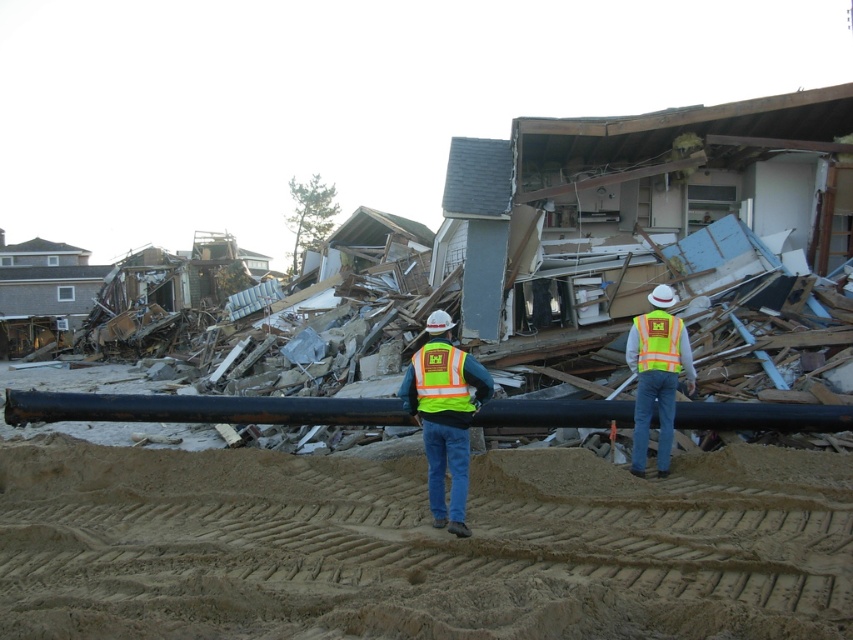
Does brown sandy dirt track at lower center appear on the right side of yellow reflective safety vest at center?

Correct, you'll find brown sandy dirt track at lower center to the right of yellow reflective safety vest at center.

Based on the photo, who is lower down, brown sandy dirt track at lower center or yellow reflective safety vest at center?

brown sandy dirt track at lower center

Locate an element on the screen. The image size is (853, 640). brown sandy dirt track at lower center is located at coordinates (421, 545).

Does point (67, 412) come behind point (421, 364)?

Yes, point (67, 412) is farther from viewer.

Is point (181, 406) positioned behind point (454, 369)?

Yes.

I want to click on black rubber water pipe at center, so click(x=201, y=408).

Measure the distance between neon yellow reflective vest at center and camera.

neon yellow reflective vest at center and camera are 5.65 meters apart from each other.

This screenshot has height=640, width=853. I want to click on neon yellow reflective vest at center, so click(x=444, y=413).